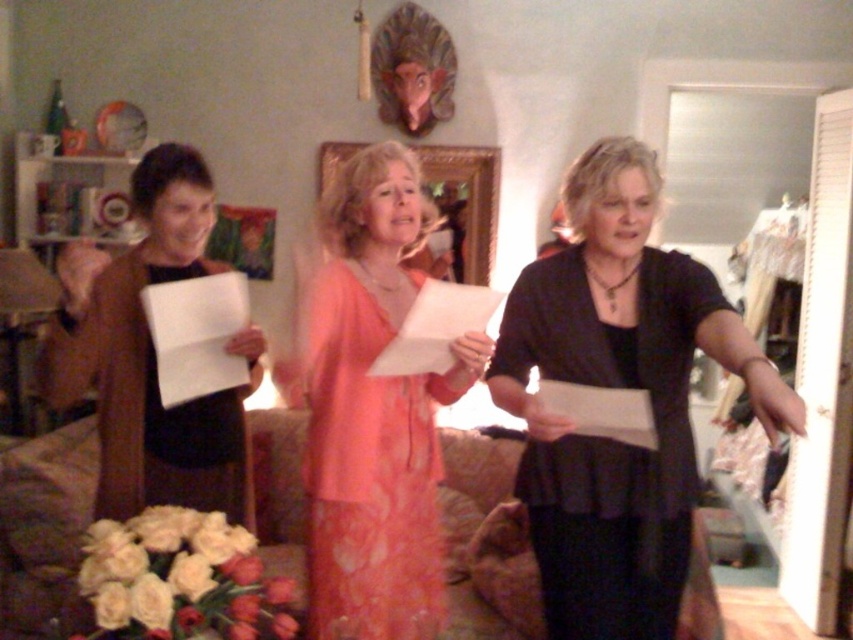
Question: Which point is farther to the camera?

Choices:
 (A) matte peach dress at center
 (B) black matte dress at center

Answer: (A)

Question: Does black matte dress at center appear under brown matte cardigan at left?

Choices:
 (A) yes
 (B) no

Answer: (A)

Question: Is black matte dress at center below matte peach dress at center?

Choices:
 (A) no
 (B) yes

Answer: (A)

Question: Is the position of black matte dress at center less distant than that of brown matte cardigan at left?

Choices:
 (A) no
 (B) yes

Answer: (B)

Question: Based on their relative distances, which object is farther from the black matte dress at center?

Choices:
 (A) brown matte cardigan at left
 (B) matte peach dress at center

Answer: (A)

Question: Which object is the closest to the brown matte cardigan at left?

Choices:
 (A) black matte dress at center
 (B) matte peach dress at center

Answer: (B)